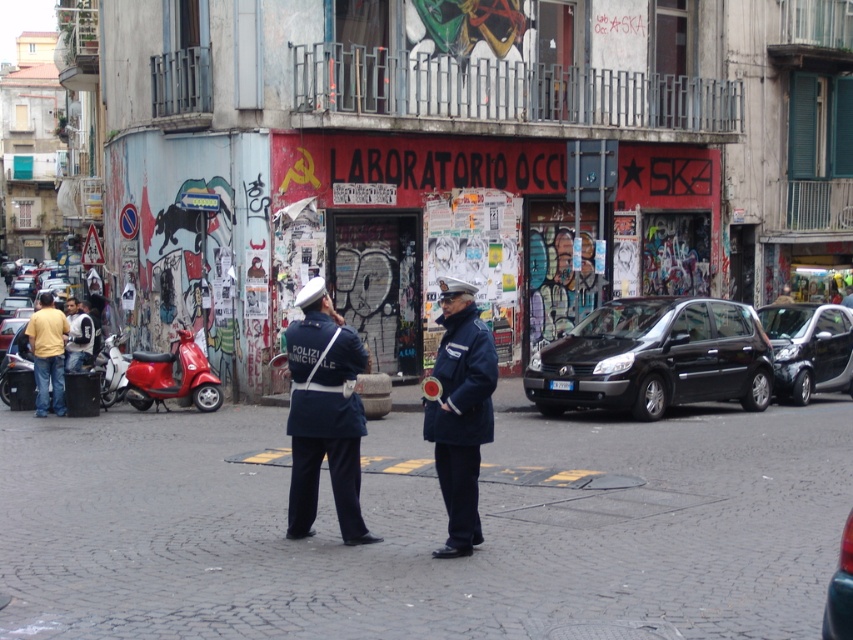
Who is more forward, (782, 372) or (786, 289)?

Answer: Point (782, 372)

Is point (784, 332) positioned in front of point (776, 301)?

Yes, point (784, 332) is closer to viewer.

The height and width of the screenshot is (640, 853). Describe the element at coordinates (808, 348) in the screenshot. I see `shiny black car at right` at that location.

Find the location of a particular element. This screenshot has height=640, width=853. shiny black car at right is located at coordinates pos(808,348).

Consider the image. Can you confirm if shiny black car at right is positioned above light blue denim jacket at left?

Actually, shiny black car at right is below light blue denim jacket at left.

Is point (764, 333) positioned before point (67, 362)?

No, (764, 333) is further to viewer.

At what (x,y) coordinates should I click in order to perform the action: click on shiny black car at right. Please return your answer as a coordinate pair (x, y). The width and height of the screenshot is (853, 640). Looking at the image, I should click on (808, 348).

Is black matte car at center below yellow cotton shirt at left?

No, black matte car at center is not below yellow cotton shirt at left.

Identify the location of black matte car at center. (654, 358).

Between point (564, 340) and point (45, 321), which one is positioned in front?

Point (564, 340) is more forward.

Image resolution: width=853 pixels, height=640 pixels. Identify the location of black matte car at center. (654, 358).